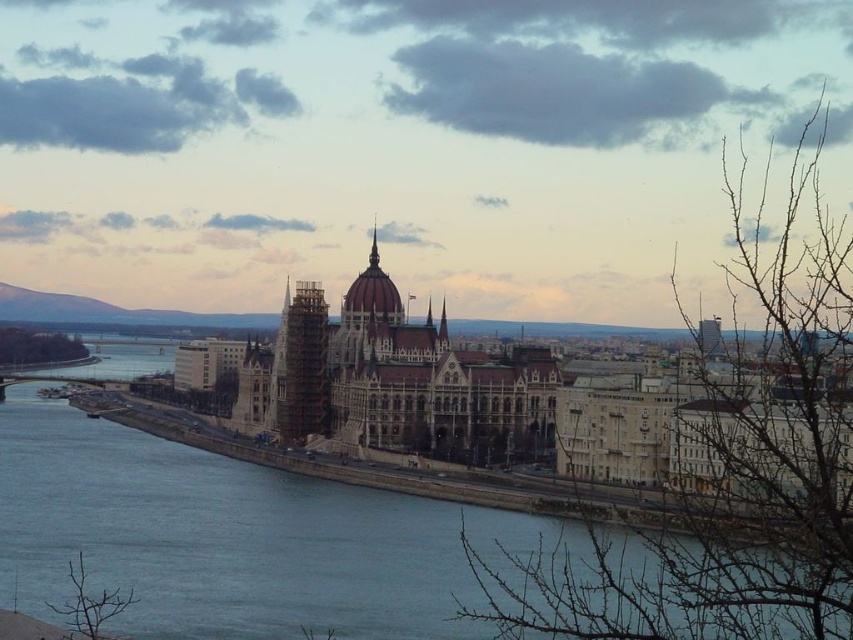
Which is above, stone gothic palace at center or wooden scaffolding at center?

stone gothic palace at center is above.

Can you confirm if stone gothic palace at center is thinner than wooden scaffolding at center?

In fact, stone gothic palace at center might be wider than wooden scaffolding at center.

Does point (660, 451) come in front of point (312, 410)?

Yes.

The height and width of the screenshot is (640, 853). I want to click on stone gothic palace at center, so click(492, 401).

Does blue water at center appear on the left side of wooden scaffolding at center?

Yes, blue water at center is to the left of wooden scaffolding at center.

Who is more distant from viewer, (44,413) or (285,300)?

The point (44,413) is behind.

At what (x,y) coordinates should I click in order to perform the action: click on blue water at center. Please return your answer as a coordinate pair (x, y). This screenshot has height=640, width=853. Looking at the image, I should click on (239, 538).

Which is behind, point (321, 620) or point (549, 378)?

The point (549, 378) is behind.

Between blue water at center and stone gothic palace at center, which one appears on the left side from the viewer's perspective?

From the viewer's perspective, blue water at center appears more on the left side.

Is point (181, 592) in front of point (695, 484)?

Yes, it is.

The width and height of the screenshot is (853, 640). In order to click on blue water at center in this screenshot , I will do `click(239, 538)`.